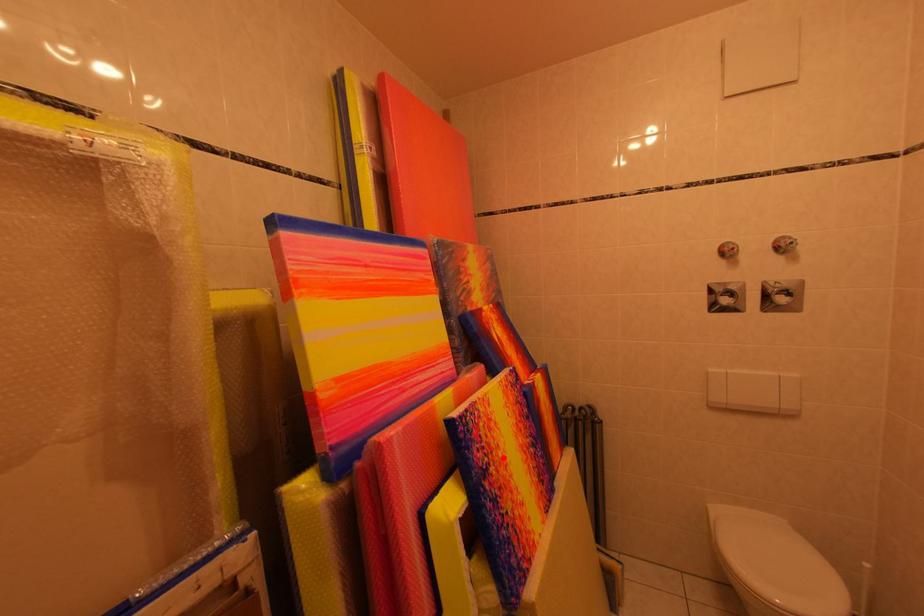
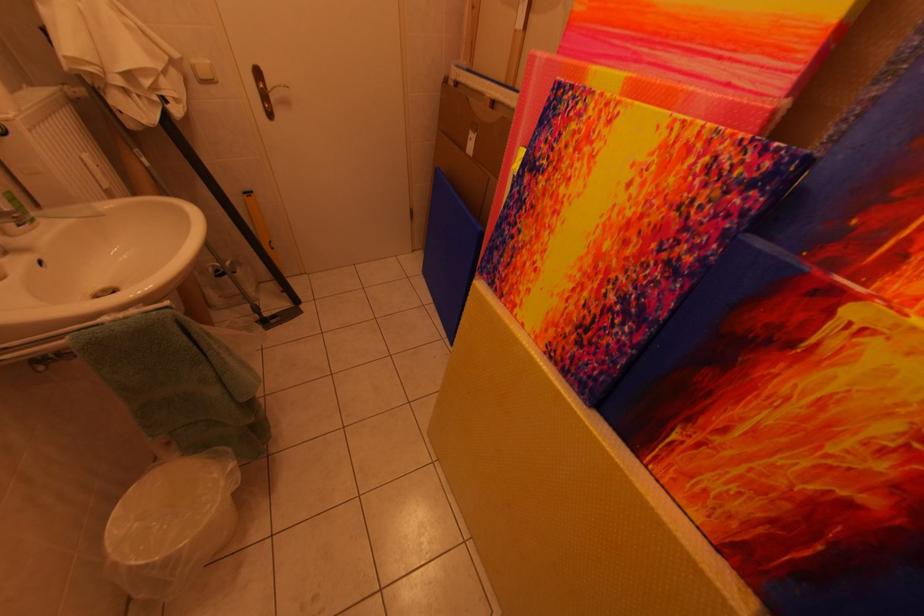
Find the pixel in the second image that matches the highlighted location in the first image.

(565, 180)